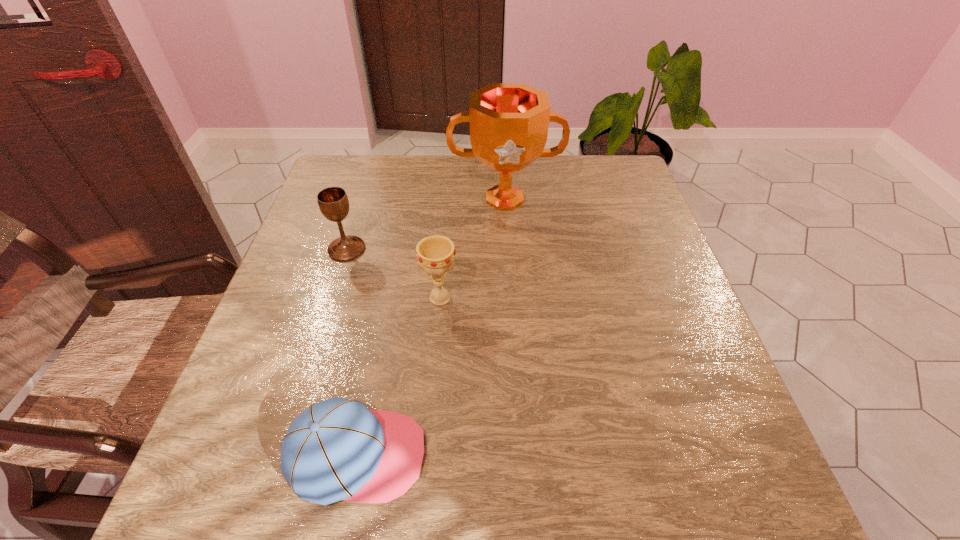
The height and width of the screenshot is (540, 960). I want to click on free spot between the award and the nearest object, so click(431, 327).

Identify the location of free area in between the nearest object and the second farthest object. This screenshot has width=960, height=540. (352, 352).

This screenshot has width=960, height=540. Identify the location of free spot between the nearer chalice and the nearest object. (398, 376).

Where is `object that is the closest to the right chalice`? The height and width of the screenshot is (540, 960). object that is the closest to the right chalice is located at coordinates (333, 202).

The height and width of the screenshot is (540, 960). What are the coordinates of `the closest object to the left chalice` in the screenshot? It's located at (435, 254).

The width and height of the screenshot is (960, 540). I want to click on vacant space that satisfies the following two spatial constraints: 1. on the side of the tallest object with the star emblem; 2. on the front-facing side of the shortest object, so click(x=521, y=455).